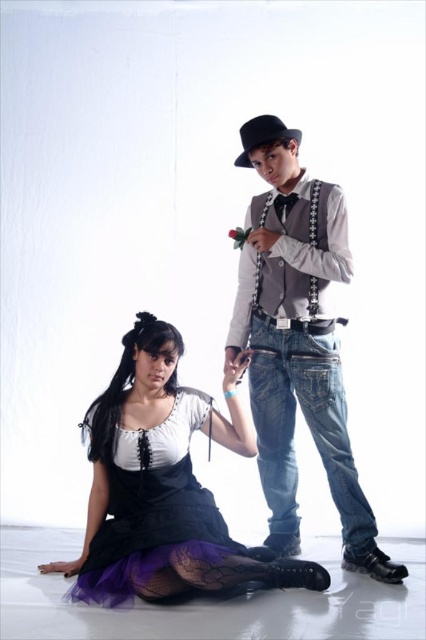
Question: Which object is positioned farthest from the gray matte vest at center?

Choices:
 (A) black felt cowboy hat at upper center
 (B) black tulle dress at lower left
 (C) matte black dress at lower left

Answer: (A)

Question: Is gray matte vest at center to the right of black tulle dress at lower left from the viewer's perspective?

Choices:
 (A) yes
 (B) no

Answer: (A)

Question: Among these objects, which one is nearest to the camera?

Choices:
 (A) gray matte vest at center
 (B) black felt cowboy hat at upper center

Answer: (B)

Question: Is gray matte vest at center positioned in front of black tulle dress at lower left?

Choices:
 (A) no
 (B) yes

Answer: (A)

Question: Is matte black dress at lower left to the right of black tulle dress at lower left from the viewer's perspective?

Choices:
 (A) yes
 (B) no

Answer: (A)

Question: Which object appears farthest from the camera in this image?

Choices:
 (A) matte black dress at lower left
 (B) gray matte vest at center

Answer: (B)